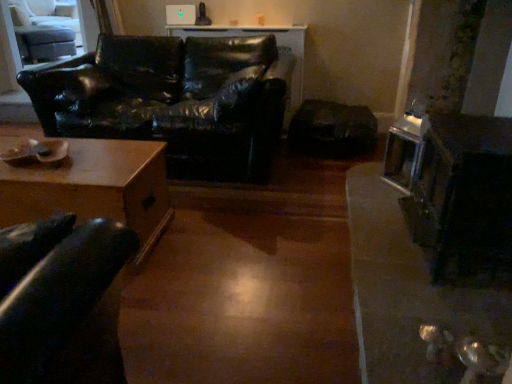
Image resolution: width=512 pixels, height=384 pixels. Identify the location of free point in front of black leather couch at left. (240, 259).